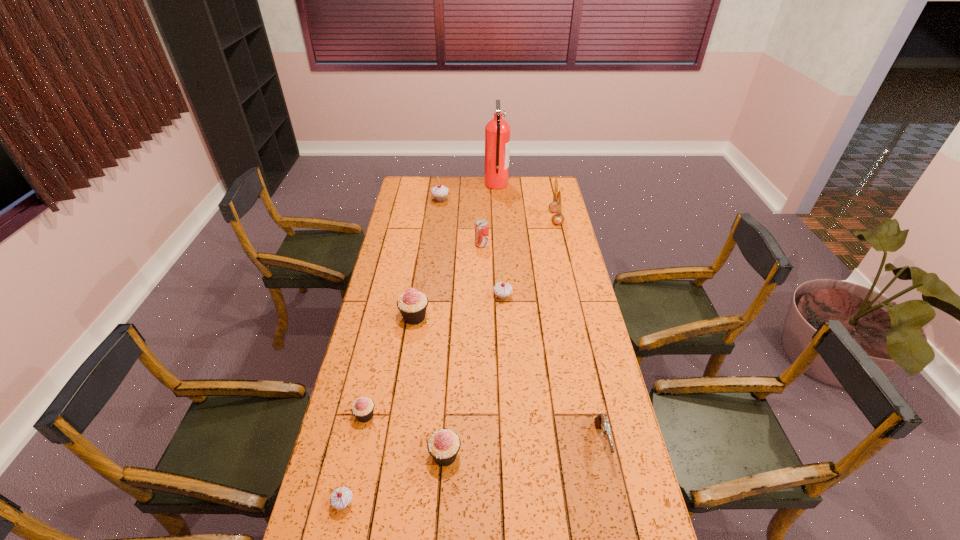
Locate an element on the screen. The width and height of the screenshot is (960, 540). the rightmost gray cupcake is located at coordinates (502, 290).

Where is `the rightmost cupcake`? The height and width of the screenshot is (540, 960). the rightmost cupcake is located at coordinates (502, 290).

What are the coordinates of `the fifth object from left to right` in the screenshot? It's located at (443, 445).

I want to click on the second biggest pink cupcake, so click(443, 445).

What are the coordinates of `gray pistol` in the screenshot? It's located at (601, 422).

Where is `the third nearest cupcake`? The image size is (960, 540). the third nearest cupcake is located at coordinates (363, 408).

This screenshot has height=540, width=960. I want to click on the second farthest pink cupcake, so click(x=363, y=408).

I want to click on the nearest cupcake, so click(341, 497).

Locate an element on the screen. the nearest object is located at coordinates (341, 497).

Identify the location of free spot located at the nozzle of the fire extinguisher. This screenshot has width=960, height=540. (414, 184).